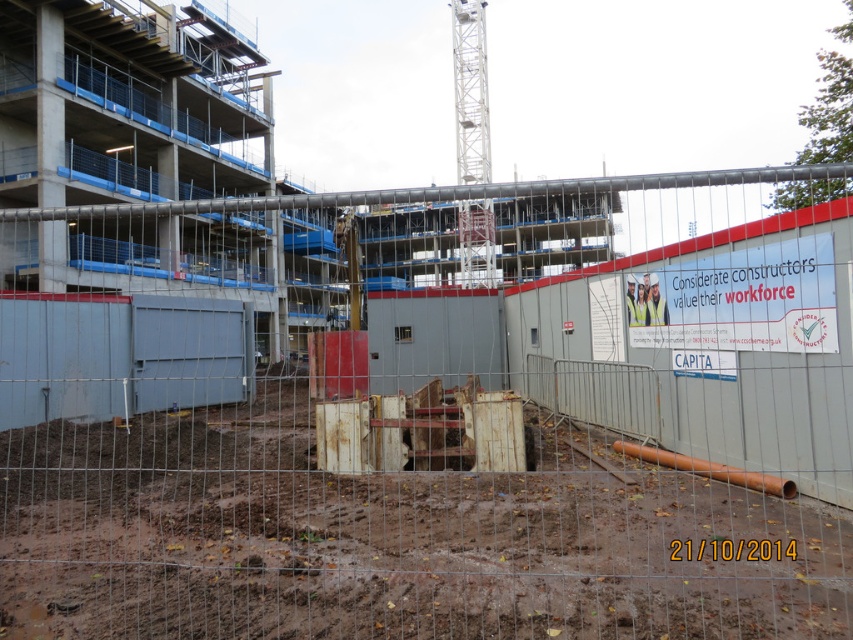
You are a construction worker who needs to place a heavy tool on a flat surface. The scene has brown muddy dirt at center and white paper at center. Which surface would you choose and why?

You should choose the brown muddy dirt at center because it is bigger than the white paper at center, providing a more stable and larger surface area for placing the heavy tool.